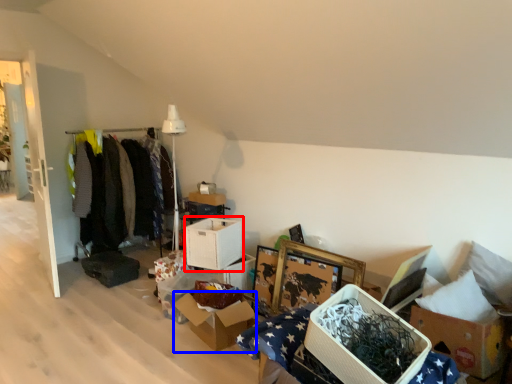
Question: Which of the following is the closest to the observer, storage box (highlighted by a red box) or cardboard box (highlighted by a blue box)?

Choices:
 (A) storage box
 (B) cardboard box

Answer: (B)